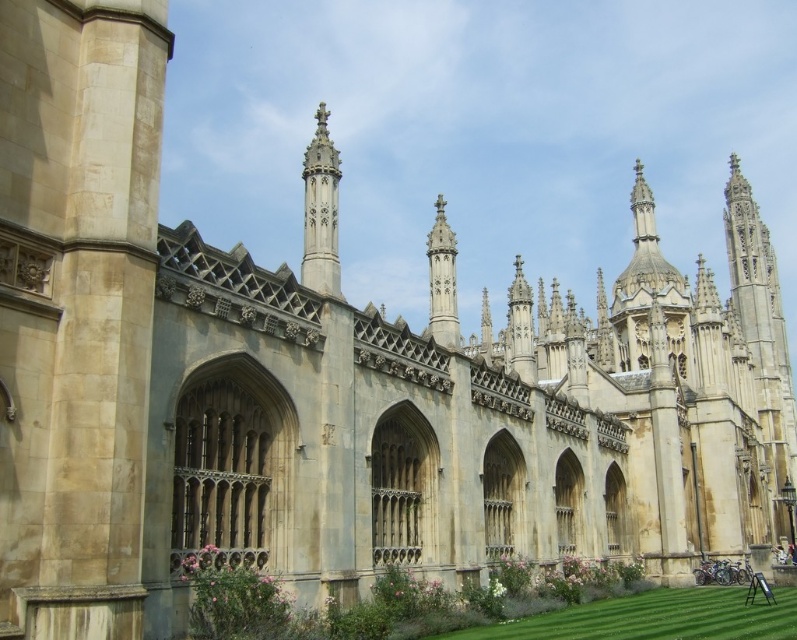
You are standing at the point labeled point (762, 337) in the image of King College Chapel. What architectural feature can be found at that exact location?

The stone gothic tower at center is located at point (762, 337).

You are an architect analyzing the structural stability of the King College Chapel. You notice the stone gothic tower at center and the polished stone spire at center. Which structure has a greater width, and how might this affect their load distribution?

The stone gothic tower at center might be wider than polished stone spire at center. This wider base could distribute the weight more evenly, potentially enhancing structural stability compared to the narrower spire.

You are standing in front of King College Chapel and want to take a photo of the stone gothic tower at center. The camera you are using has a focus point at coordinate point (762, 337). Will this focus point land on the stone gothic tower at center?

Yes, the point (762, 337) is on the stone gothic tower at center, so the focus point will land on it.